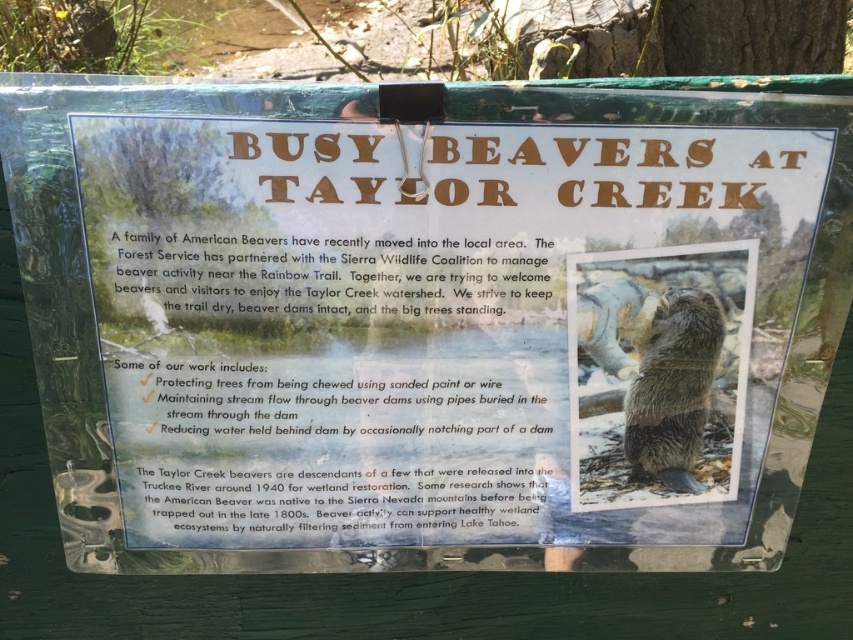
Question: Which point is farther from the camera taking this photo?

Choices:
 (A) (653, 429)
 (B) (648, 285)

Answer: (A)

Question: Which point appears farthest from the camera in this image?

Choices:
 (A) (639, 360)
 (B) (608, 362)

Answer: (A)

Question: Can you confirm if fuzzy brown beaver at center is thinner than fuzzy brown otter at center?

Choices:
 (A) yes
 (B) no

Answer: (B)

Question: Which object is farther from the camera taking this photo?

Choices:
 (A) fuzzy brown otter at center
 (B) fuzzy brown beaver at center

Answer: (A)

Question: Is fuzzy brown beaver at center wider than fuzzy brown otter at center?

Choices:
 (A) yes
 (B) no

Answer: (A)

Question: Can you confirm if fuzzy brown beaver at center is positioned below fuzzy brown otter at center?

Choices:
 (A) yes
 (B) no

Answer: (B)